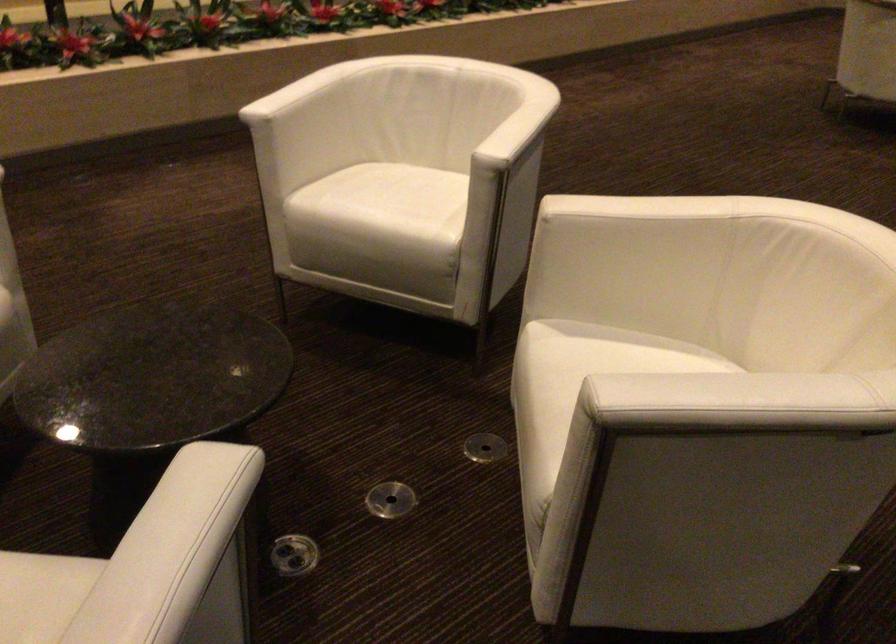
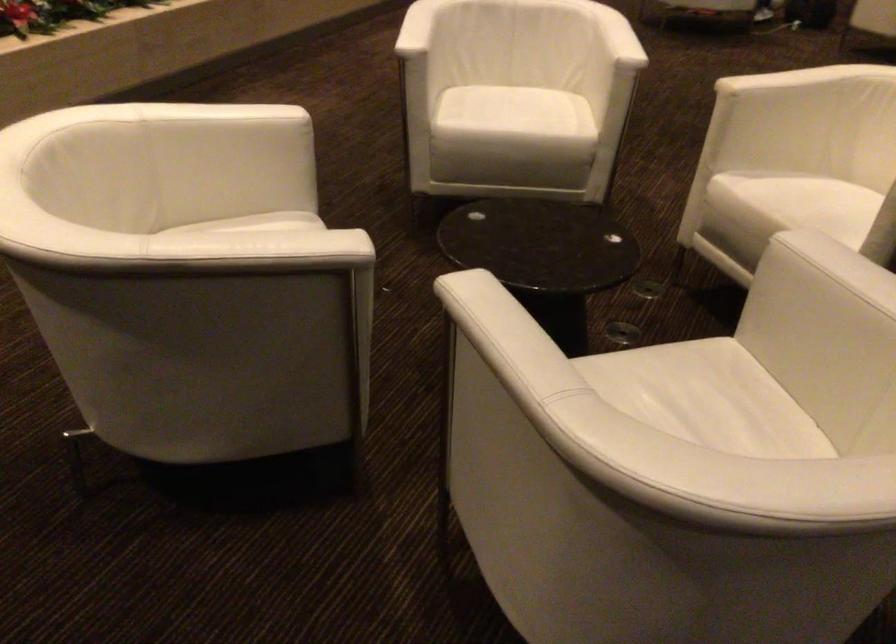
Where in the second image is the point corresponding to (627,216) from the first image?

(789, 80)